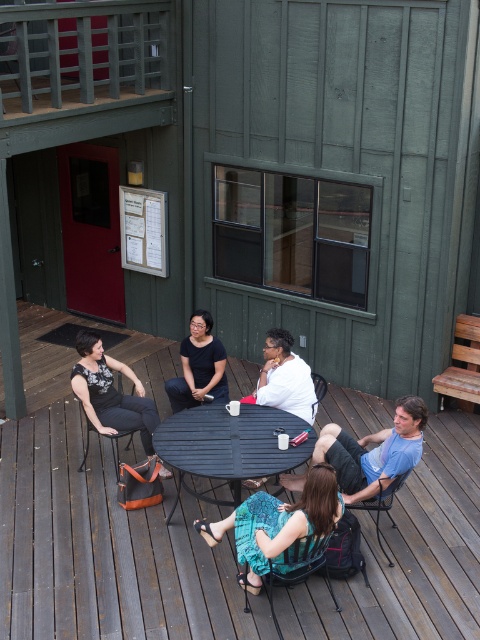
Question: Which of these objects is positioned closest to the blue patterned dress at center?

Choices:
 (A) matte black dress at lower left
 (B) metallic black chair at lower right

Answer: (B)

Question: Is matte black dress at lower left to the right of white matte shirt at center from the viewer's perspective?

Choices:
 (A) yes
 (B) no

Answer: (B)

Question: Does blue patterned dress at center come in front of white matte shirt at center?

Choices:
 (A) yes
 (B) no

Answer: (A)

Question: Which is farther from the metallic silver chair at center?

Choices:
 (A) white matte shirt at center
 (B) metallic black chair at lower right

Answer: (B)

Question: Does white matte shirt at center lie behind matte black chair at lower left?

Choices:
 (A) no
 (B) yes

Answer: (A)

Question: Estimate the real-world distances between objects in this image. Which object is farther from the wooden deck at center?

Choices:
 (A) matte black dress at lower left
 (B) metallic black chair at lower center
 (C) blue patterned dress at center

Answer: (A)